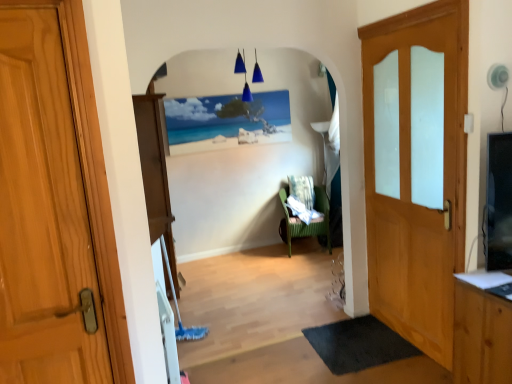
You are a GUI agent. You are given a task and a screenshot of the screen. Output one action in this format:
    pyautogui.click(x=<x>, y=<y>)
    Task: Click on the free location above matte wooden picture frame at center (from a real-world perspective)
    This screenshot has width=512, height=384.
    Given the screenshot: What is the action you would take?
    pyautogui.click(x=233, y=92)